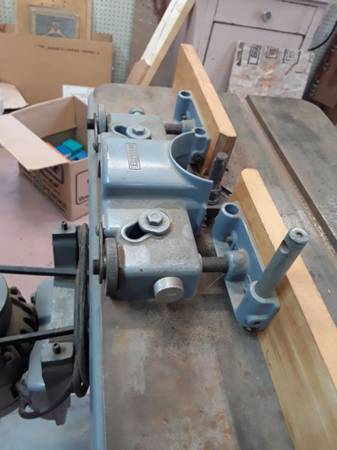
Find the location of a particular element. The width and height of the screenshot is (337, 450). framed picture is located at coordinates (76, 22).